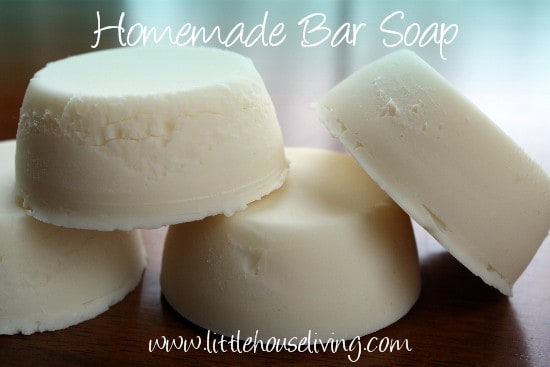
Where is `soap`? The image size is (550, 367). soap is located at coordinates (423, 178).